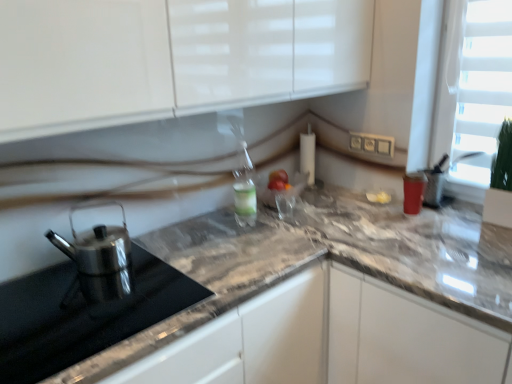
Question: From a real-world perspective, is polished stainless steel kettle at left located beneath polished stainless steel kettle at left?

Choices:
 (A) yes
 (B) no

Answer: (B)

Question: Does polished stainless steel kettle at left have a greater width compared to polished stainless steel kettle at left?

Choices:
 (A) yes
 (B) no

Answer: (B)

Question: Is polished stainless steel kettle at left beside polished stainless steel kettle at left?

Choices:
 (A) yes
 (B) no

Answer: (B)

Question: From the image's perspective, is polished stainless steel kettle at left below polished stainless steel kettle at left?

Choices:
 (A) yes
 (B) no

Answer: (B)

Question: Is polished stainless steel kettle at left bigger than polished stainless steel kettle at left?

Choices:
 (A) no
 (B) yes

Answer: (A)

Question: Is polished stainless steel kettle at left in front of or behind marble countertop at right in the image?

Choices:
 (A) behind
 (B) front

Answer: (B)

Question: Which is correct: polished stainless steel kettle at left is inside marble countertop at right, or outside of it?

Choices:
 (A) inside
 (B) outside

Answer: (B)

Question: From the image's perspective, is polished stainless steel kettle at left located above or below marble countertop at right?

Choices:
 (A) below
 (B) above

Answer: (B)

Question: Considering the relative positions of polished stainless steel kettle at left and marble countertop at right in the image provided, is polished stainless steel kettle at left to the left or to the right of marble countertop at right?

Choices:
 (A) right
 (B) left

Answer: (B)

Question: Considering the positions of point (61, 304) and point (388, 286), is point (61, 304) closer or farther from the camera than point (388, 286)?

Choices:
 (A) farther
 (B) closer

Answer: (B)

Question: In terms of width, does polished stainless steel kettle at left look wider or thinner when compared to marble countertop at right?

Choices:
 (A) wide
 (B) thin

Answer: (B)

Question: Which is correct: polished stainless steel kettle at left is inside marble countertop at right, or outside of it?

Choices:
 (A) inside
 (B) outside

Answer: (B)

Question: From the image's perspective, relative to marble countertop at right, is polished stainless steel kettle at left above or below?

Choices:
 (A) above
 (B) below

Answer: (A)

Question: Considering the positions of marble countertop at right and polished stainless steel kettle at left in the image, is marble countertop at right wider or thinner than polished stainless steel kettle at left?

Choices:
 (A) wide
 (B) thin

Answer: (A)

Question: Is point (369, 370) closer or farther from the camera than point (96, 238)?

Choices:
 (A) farther
 (B) closer

Answer: (B)